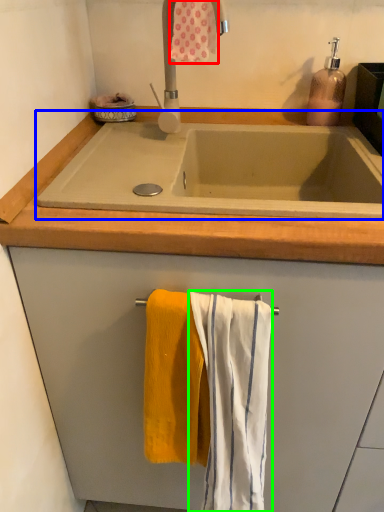
Question: Estimate the real-world distances between objects in this image. Which object is farther from bath towel (highlighted by a red box), bath (highlighted by a blue box) or bath towel (highlighted by a green box)?

Choices:
 (A) bath
 (B) bath towel

Answer: (B)